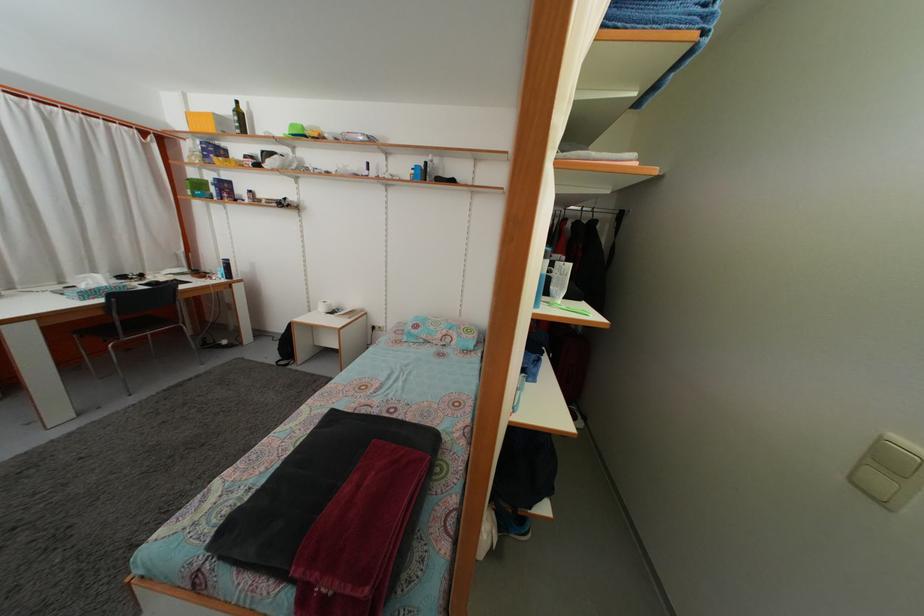
The location [558,280] corresponds to which object?

This point indicates the clear plastic cup.